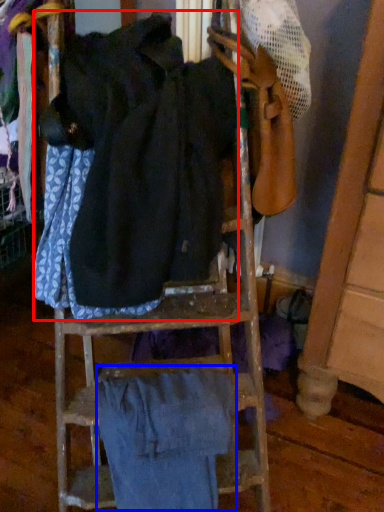
Question: Which object appears closest to the camera in this image, wide (highlighted by a red box) or wide (highlighted by a blue box)?

Choices:
 (A) wide
 (B) wide

Answer: (A)